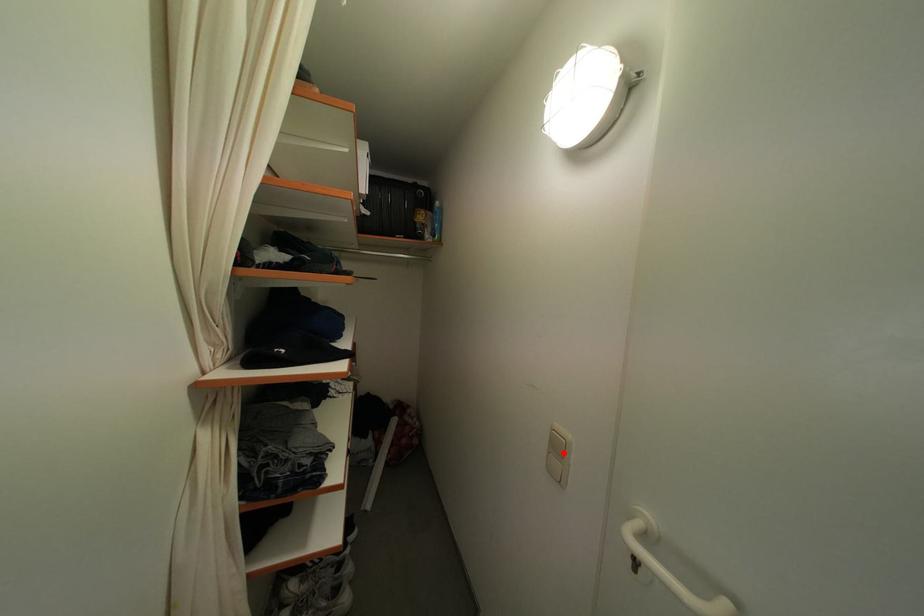
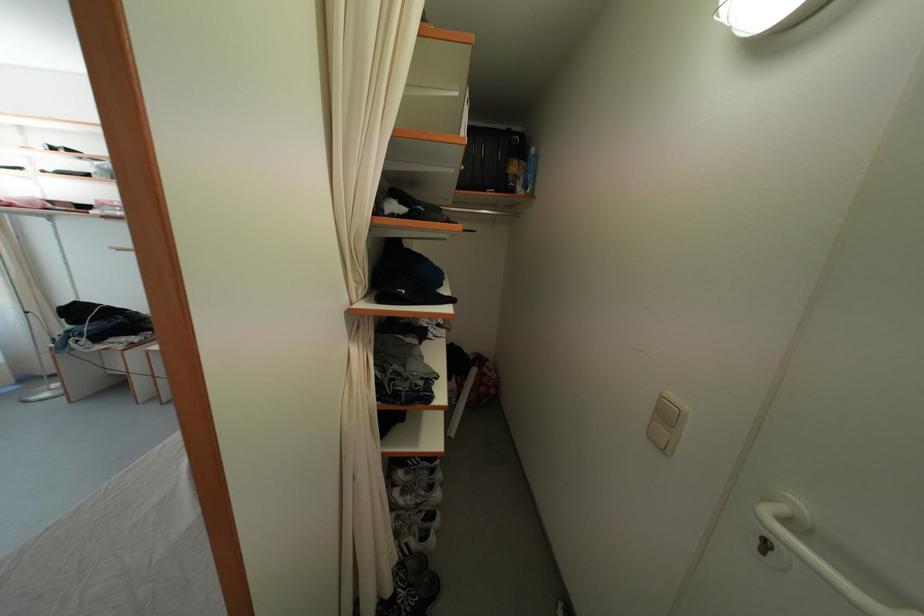
In the second image, find the point that corresponds to the highlighted location in the first image.

(672, 421)